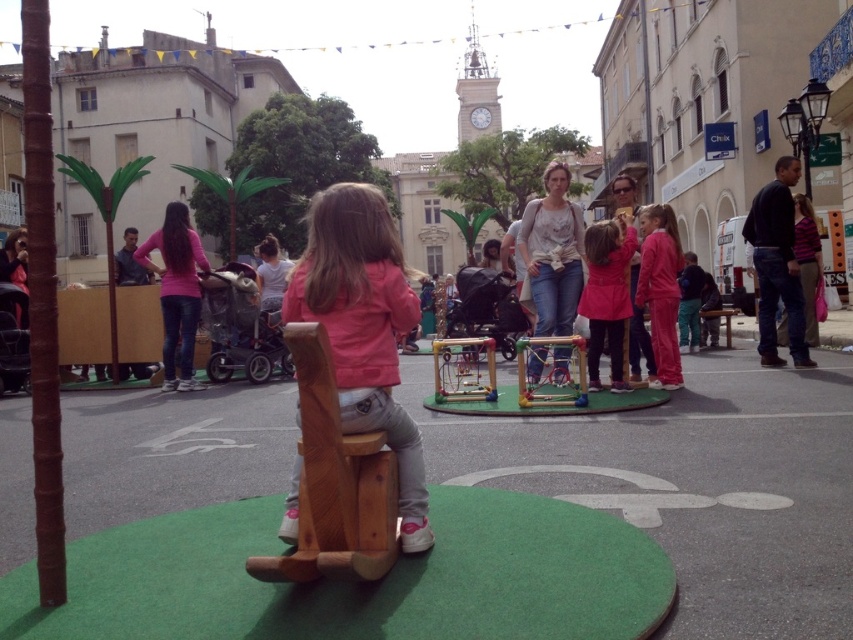
Is matte pink jacket at center smaller than matte pink coat at center?

No, matte pink jacket at center is not smaller than matte pink coat at center.

Can you confirm if matte pink jacket at center is positioned to the left of matte pink coat at center?

Correct, you'll find matte pink jacket at center to the left of matte pink coat at center.

At what (x,y) coordinates should I click in order to perform the action: click on matte pink jacket at center. Please return your answer as a coordinate pair (x, y). Looking at the image, I should click on (364, 328).

Who is positioned more to the right, wooden at center or metallic yellow swing at center?

metallic yellow swing at center is more to the right.

Locate an element on the screen. wooden at center is located at coordinates (334, 483).

This screenshot has height=640, width=853. Describe the element at coordinates (334, 483) in the screenshot. I see `wooden at center` at that location.

Where is `wooden at center`? wooden at center is located at coordinates click(334, 483).

Which is in front, point (328, 308) or point (561, 337)?

Positioned in front is point (328, 308).

Is matte pink jacket at center bigger than metallic silver frame at center?

Yes, matte pink jacket at center is bigger than metallic silver frame at center.

Which is behind, point (337, 241) or point (552, 372)?

The point (552, 372) is behind.

Locate an element on the screen. The height and width of the screenshot is (640, 853). matte pink jacket at center is located at coordinates (364, 328).